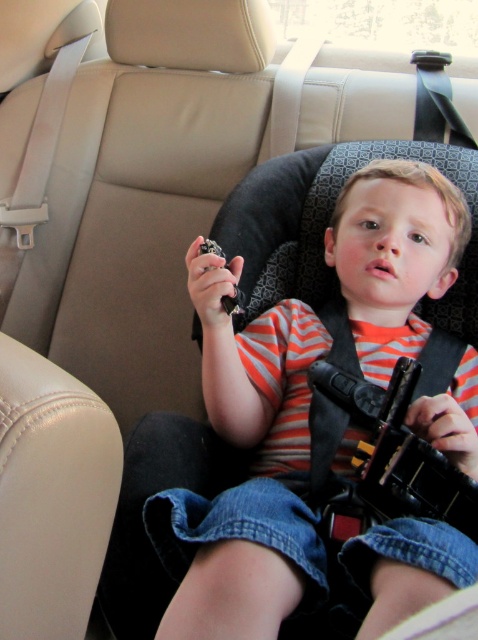
Question: Can you confirm if striped cotton shirt at center is smaller than black plastic toy gun at center?

Choices:
 (A) yes
 (B) no

Answer: (B)

Question: Which point is closer to the camera?

Choices:
 (A) (401, 512)
 (B) (261, 573)

Answer: (B)

Question: Which point is farther to the camera?

Choices:
 (A) (224, 548)
 (B) (369, 499)

Answer: (B)

Question: Is striped cotton shirt at center bigger than black plastic toy gun at center?

Choices:
 (A) yes
 (B) no

Answer: (A)

Question: Does striped cotton shirt at center appear over black plastic toy gun at center?

Choices:
 (A) yes
 (B) no

Answer: (A)

Question: Which object appears farthest from the camera in this image?

Choices:
 (A) striped cotton shirt at center
 (B) black plastic toy gun at center

Answer: (B)